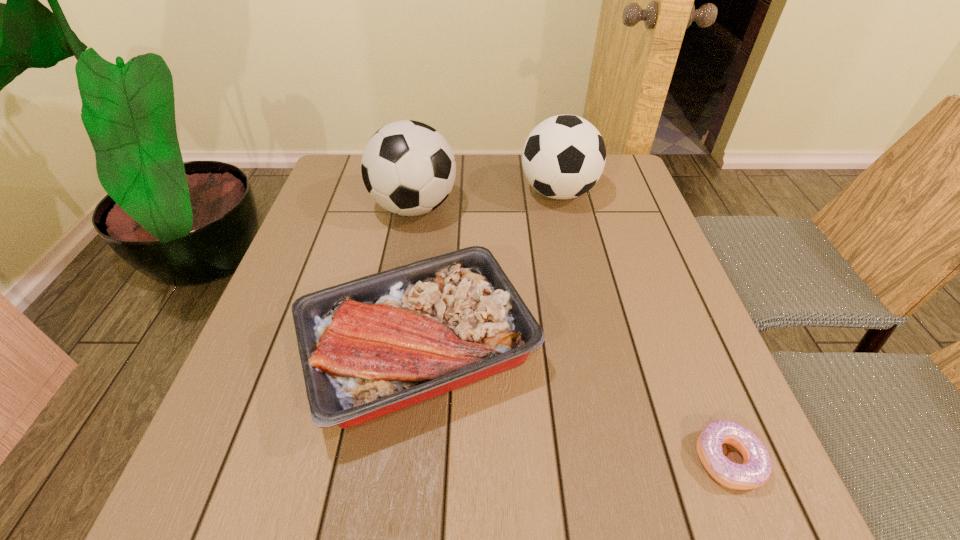
The image size is (960, 540). What are the coordinates of `vacant space at the right edge of the desktop` in the screenshot? It's located at (684, 352).

Find the location of a particular element. vacant space at the far left corner of the desktop is located at coordinates (350, 165).

In the image, there is a desktop. Identify the location of vacant space at the near left corner. The width and height of the screenshot is (960, 540). (212, 516).

The height and width of the screenshot is (540, 960). I want to click on vacant point at the far right corner, so point(615,188).

Locate an element on the screen. This screenshot has width=960, height=540. free location at the near right corner of the desktop is located at coordinates click(x=716, y=496).

I want to click on empty location between the left soccer ball and the right soccer ball, so click(x=486, y=200).

Locate an element on the screen. The height and width of the screenshot is (540, 960). free space between the tray and the shortest object is located at coordinates (573, 405).

Locate an element on the screen. unoccupied position between the right soccer ball and the doughnut is located at coordinates pos(643,326).

Identify the location of free spot between the right soccer ball and the left soccer ball. The height and width of the screenshot is (540, 960). (486, 200).

The image size is (960, 540). I want to click on free space that is in between the left soccer ball and the shortest object, so click(x=571, y=333).